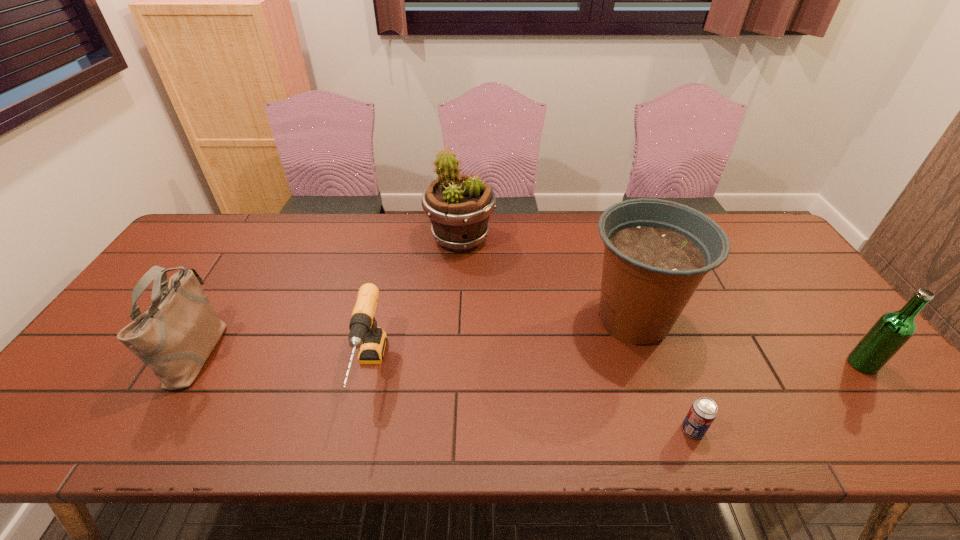
Locate an element on the screen. This screenshot has width=960, height=540. empty space between the shoulder bag and the nearer flowerpot is located at coordinates (417, 335).

This screenshot has width=960, height=540. In order to click on unoccupied area between the shoulder bag and the right flowerpot in this screenshot , I will do `click(417, 335)`.

At what (x,y) coordinates should I click in order to perform the action: click on empty space that is in between the beer bottle and the shortest object. Please return your answer as a coordinate pair (x, y). This screenshot has height=540, width=960. Looking at the image, I should click on (778, 397).

Locate an element on the screen. The width and height of the screenshot is (960, 540). vacant space that's between the beer can and the nearer flowerpot is located at coordinates (663, 375).

I want to click on vacant area that lies between the leftmost object and the fourth object from right to left, so click(329, 294).

You are a GUI agent. You are given a task and a screenshot of the screen. Output one action in this format:
    pyautogui.click(x=<x>, y=<y>)
    Task: Click on the free space between the fifth object from right to left and the nearer flowerpot
    
    Given the screenshot: What is the action you would take?
    pyautogui.click(x=501, y=346)

What are the coordinates of `empty space that is in between the drill and the beer can` in the screenshot? It's located at (531, 401).

The image size is (960, 540). Identify the location of empty location between the drill and the shoulder bag. (284, 361).

You are a GUI agent. You are given a task and a screenshot of the screen. Output one action in this format:
    pyautogui.click(x=<x>, y=<y>)
    Task: Click on the vacant space that is in between the beer can and the shoulder bag
    
    Given the screenshot: What is the action you would take?
    pyautogui.click(x=445, y=390)

What are the coordinates of `free spot between the farther flowerpot and the drill` in the screenshot? It's located at (415, 305).